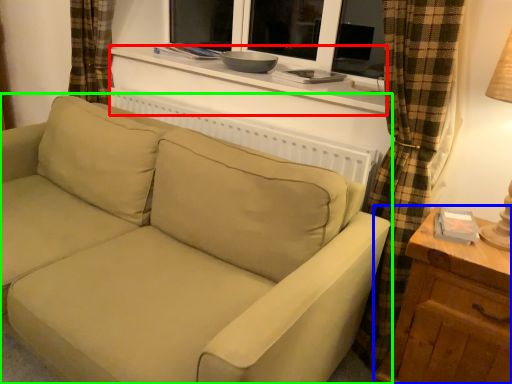
Question: Considering the real-world distances, which object is closest to window sill (highlighted by a red box)? table (highlighted by a blue box) or studio couch (highlighted by a green box).

Choices:
 (A) table
 (B) studio couch

Answer: (B)